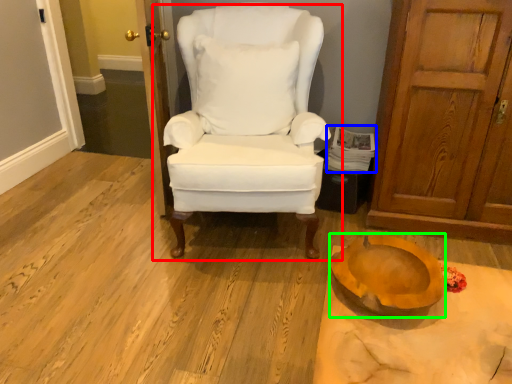
Question: Which object is the closest to the chair (highlighted by a red box)? Choose among these: magazine (highlighted by a blue box) or oval (highlighted by a green box).

Choices:
 (A) magazine
 (B) oval

Answer: (A)